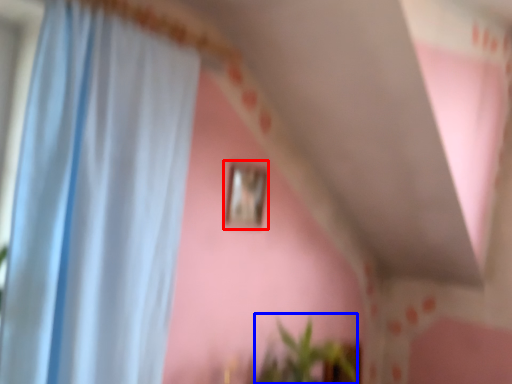
Question: Which point is further to the camera, picture frame (highlighted by a red box) or plant (highlighted by a blue box)?

Choices:
 (A) picture frame
 (B) plant

Answer: (A)